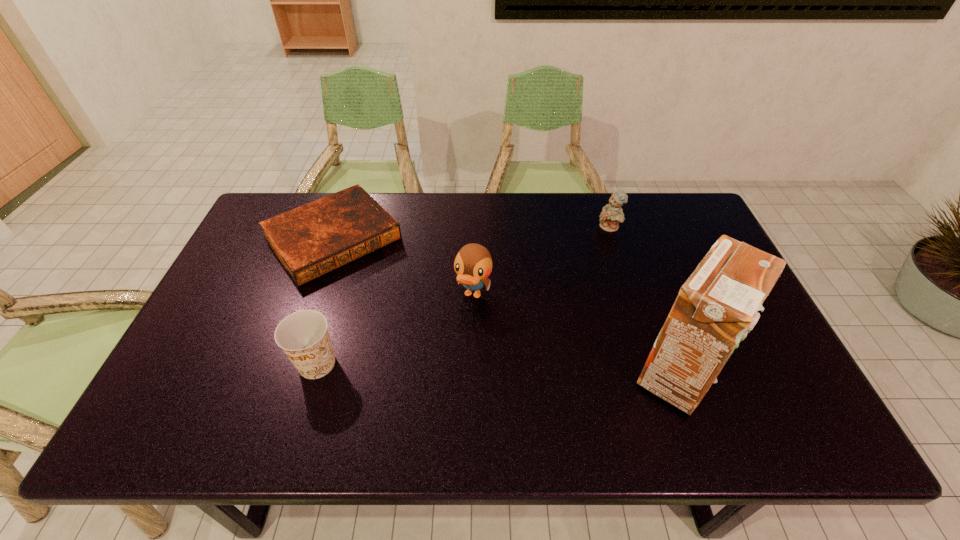
The image size is (960, 540). Find the location of `object that is the third closest to the teddy bear`. object that is the third closest to the teddy bear is located at coordinates (316, 238).

Find the location of `vacant space that satisfies the following two spatial constraints: 1. on the back side of the Dixie cup; 2. on the left side of the third object from left to right`. vacant space that satisfies the following two spatial constraints: 1. on the back side of the Dixie cup; 2. on the left side of the third object from left to right is located at coordinates (338, 295).

Where is `free region that satisfies the following two spatial constraints: 1. on the front side of the teddy bear; 2. on the straw side of the carton`? Image resolution: width=960 pixels, height=540 pixels. free region that satisfies the following two spatial constraints: 1. on the front side of the teddy bear; 2. on the straw side of the carton is located at coordinates (655, 375).

Find the location of `vacant space that satisfies the following two spatial constraints: 1. on the back side of the Dixie cup; 2. on the left side of the teddy bear`. vacant space that satisfies the following two spatial constraints: 1. on the back side of the Dixie cup; 2. on the left side of the teddy bear is located at coordinates (358, 228).

Identify the location of free space that satisfies the following two spatial constraints: 1. on the front side of the tallest object; 2. on the straw side of the teddy bear. (655, 375).

What are the coordinates of `free point that satisfies the following two spatial constraints: 1. on the front side of the tallest object; 2. on the straw side of the shortest object` in the screenshot? It's located at (x=284, y=375).

The height and width of the screenshot is (540, 960). In order to click on vacant region that satisfies the following two spatial constraints: 1. on the front side of the carton; 2. on the straw side of the teddy bear in this screenshot , I will do `click(655, 375)`.